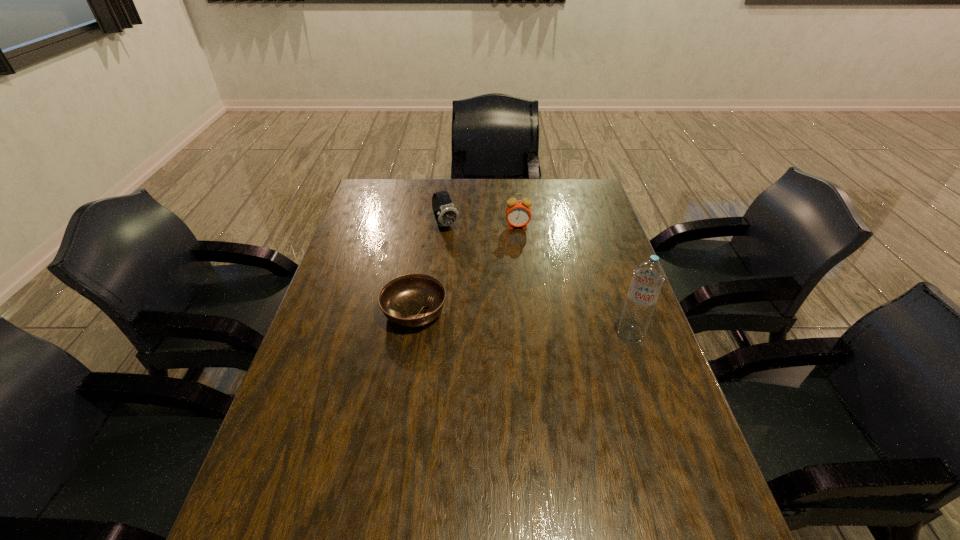
The height and width of the screenshot is (540, 960). Find the location of `unoccupied area between the water bottle and the watch`. unoccupied area between the water bottle and the watch is located at coordinates (538, 280).

At what (x,y) coordinates should I click in order to perform the action: click on vacant area between the third object from left to right and the watch. Please return your answer as a coordinate pair (x, y). The height and width of the screenshot is (540, 960). Looking at the image, I should click on (482, 226).

You are a GUI agent. You are given a task and a screenshot of the screen. Output one action in this format:
    pyautogui.click(x=<x>, y=<y>)
    Task: Click on the free space between the watch and the tallest object
    
    Given the screenshot: What is the action you would take?
    pyautogui.click(x=538, y=280)

This screenshot has height=540, width=960. I want to click on free spot between the watch and the soup bowl, so click(430, 268).

This screenshot has width=960, height=540. Find the location of `empty space between the tallest object and the watch`. empty space between the tallest object and the watch is located at coordinates (538, 280).

Image resolution: width=960 pixels, height=540 pixels. I want to click on empty space that is in between the watch and the alarm clock, so click(x=482, y=226).

Image resolution: width=960 pixels, height=540 pixels. Find the location of `unoccupied position between the soup bowl and the tallest object`. unoccupied position between the soup bowl and the tallest object is located at coordinates (522, 323).

In order to click on free space between the tallest object and the watch in this screenshot , I will do `click(538, 280)`.

The height and width of the screenshot is (540, 960). I want to click on object that is the second nearest to the tallest object, so click(518, 213).

I want to click on the closest object to the soup bowl, so click(x=446, y=214).